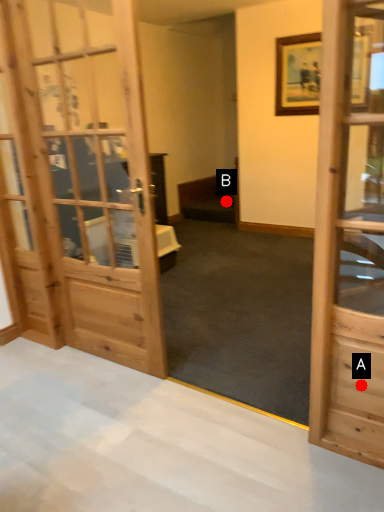
Question: Two points are circled on the image, labeled by A and B beside each circle. Which point is farther from the camera taking this photo?

Choices:
 (A) A is further
 (B) B is further

Answer: (B)